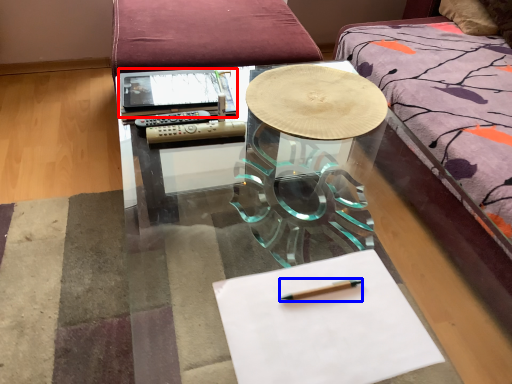
Question: Which object is closer to the camera taking this photo, notebook (highlighted by a red box) or pencil (highlighted by a blue box)?

Choices:
 (A) notebook
 (B) pencil

Answer: (B)